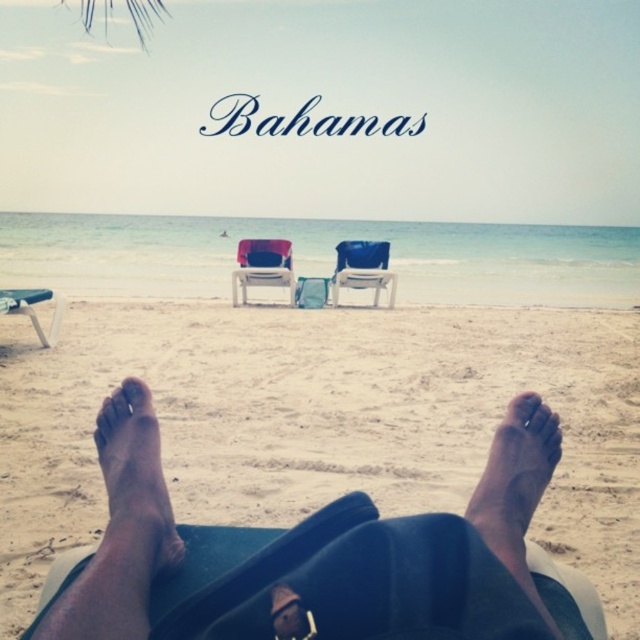
You are standing on the beach and see the brown skin at lower center and the blue plastic chair at center. Which object is positioned more to the left side of the scene?

The brown skin at lower center is positioned more to the left side of the scene than the blue plastic chair at center.

You are a photographer trying to capture the scene from the beach. You notice the brown skin at lower center and the matte pink fabric chair at center. Which object appears narrower in the photo?

The brown skin at lower center appears narrower than the matte pink fabric chair at center in the photo.

You are lying on a sunbed and want to reach either the blue plastic chair at center or the matte pink fabric chair at center without getting up. Which chair is closer to your current position?

The matte pink fabric chair at center is closer because the blue plastic chair at center is positioned to its right, meaning it is farther away from your current position on the sunbed.